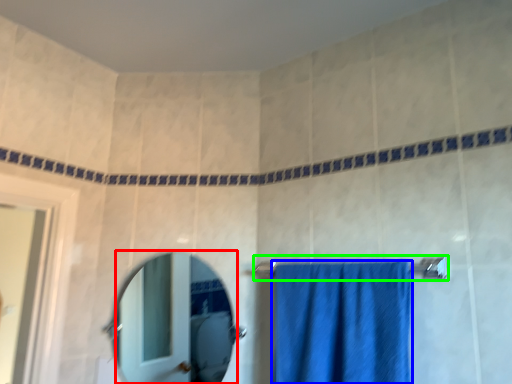
Question: Considering the real-world distances, which object is farthest from mirror (highlighted by a red box)? towel (highlighted by a blue box) or towel bar (highlighted by a green box)?

Choices:
 (A) towel
 (B) towel bar

Answer: (B)